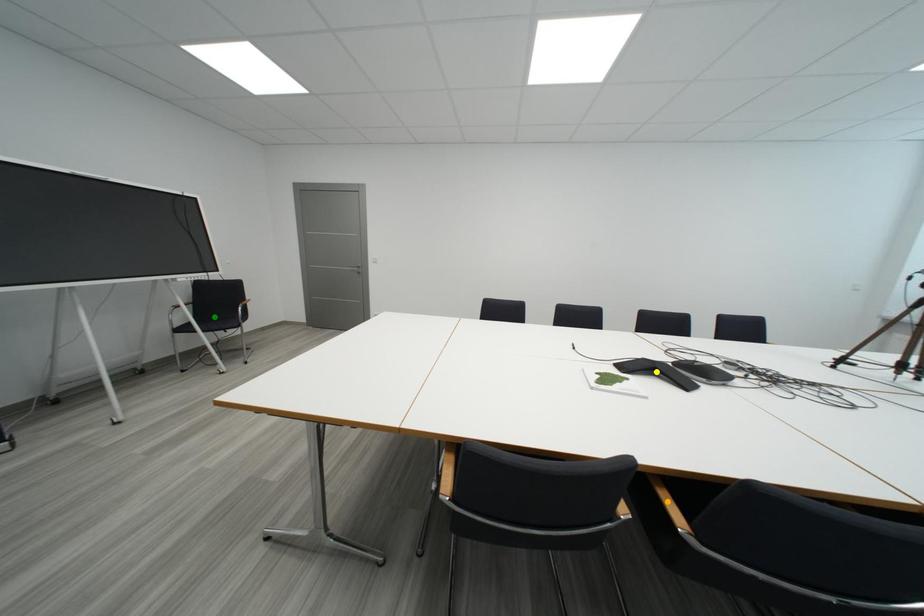
Order these from nearest to farthest:
green point, yellow point, orange point

orange point, yellow point, green point